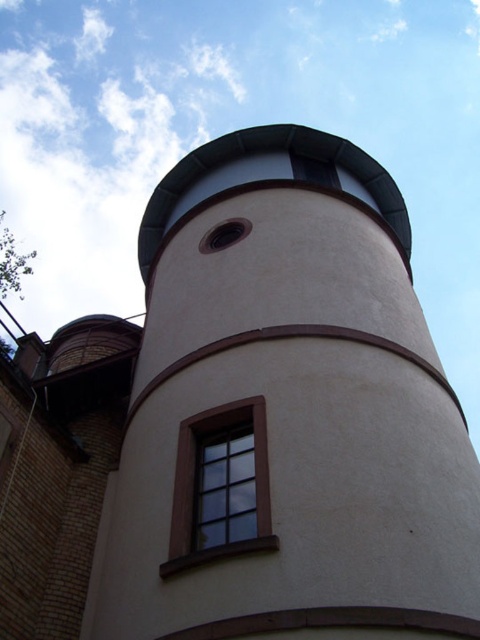
Question: Which point is farther from the camera taking this photo?

Choices:
 (A) (272, 520)
 (B) (218, 426)

Answer: (B)

Question: Does smooth beige tower at center lie behind brown wooden window at center?

Choices:
 (A) yes
 (B) no

Answer: (B)

Question: Can you confirm if smooth beige tower at center is positioned above brown wooden window at center?

Choices:
 (A) yes
 (B) no

Answer: (A)

Question: Can you confirm if smooth beige tower at center is positioned to the right of brown wooden window at center?

Choices:
 (A) yes
 (B) no

Answer: (A)

Question: Which object appears farthest from the camera in this image?

Choices:
 (A) smooth beige tower at center
 (B) brown wooden window at center

Answer: (B)